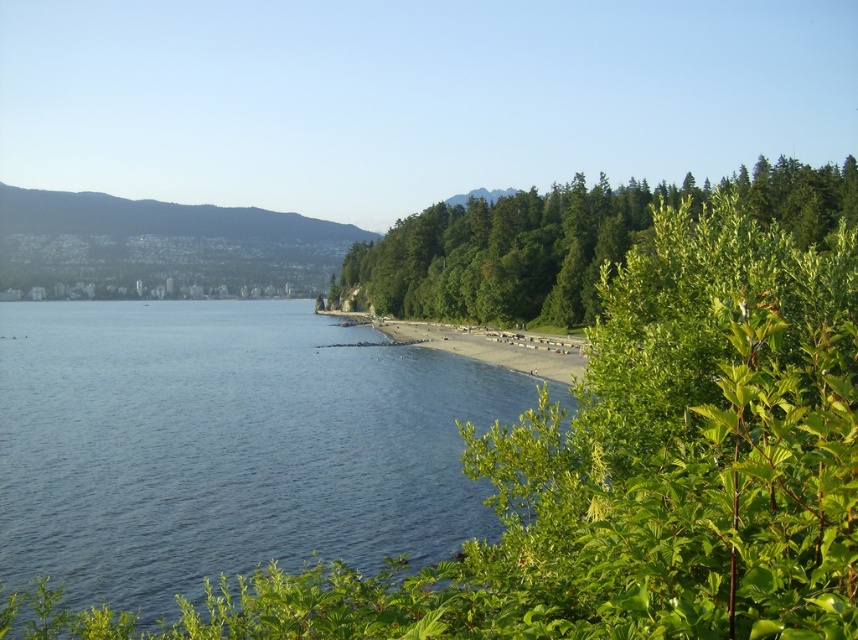
Question: Which point appears farthest from the camera in this image?

Choices:
 (A) (769, 179)
 (B) (252, 368)

Answer: (A)

Question: Can you confirm if blue water at lower left is positioned to the right of green leafy trees at center?

Choices:
 (A) no
 (B) yes

Answer: (A)

Question: Is blue water at lower left positioned in front of green leafy trees at center?

Choices:
 (A) no
 (B) yes

Answer: (B)

Question: Which point is closer to the camera?

Choices:
 (A) green leafy trees at center
 (B) blue water at lower left

Answer: (B)

Question: Considering the relative positions of blue water at lower left and green leafy trees at center in the image provided, where is blue water at lower left located with respect to green leafy trees at center?

Choices:
 (A) right
 (B) left

Answer: (B)